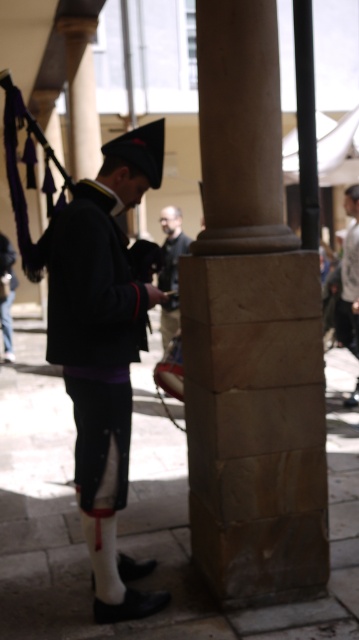
Can you confirm if brown stone pillar at center is positioned to the right of matte black uniform at center?

Correct, you'll find brown stone pillar at center to the right of matte black uniform at center.

Is point (269, 70) behind point (126, 134)?

Yes, it is.

Locate an element on the screen. The width and height of the screenshot is (359, 640). brown stone pillar at center is located at coordinates (250, 333).

Is matte black uniform at center positioned in front of dark gray uniform at center?

Yes.

Does matte black uniform at center have a lesser height compared to dark gray uniform at center?

In fact, matte black uniform at center may be taller than dark gray uniform at center.

Is point (106, 314) farther from camera compared to point (171, 241)?

No, it is not.

Identify the location of matte black uniform at center. The image size is (359, 640). (104, 352).

Does brown stone pillar at center come in front of black polished pole at center?

Yes, brown stone pillar at center is closer to the viewer.

Does brown stone pillar at center have a smaller size compared to black polished pole at center?

No, brown stone pillar at center is not smaller than black polished pole at center.

Is point (263, 532) positioned in front of point (314, 243)?

Yes, it is.

Identify the location of brown stone pillar at center. Image resolution: width=359 pixels, height=640 pixels. (250, 333).